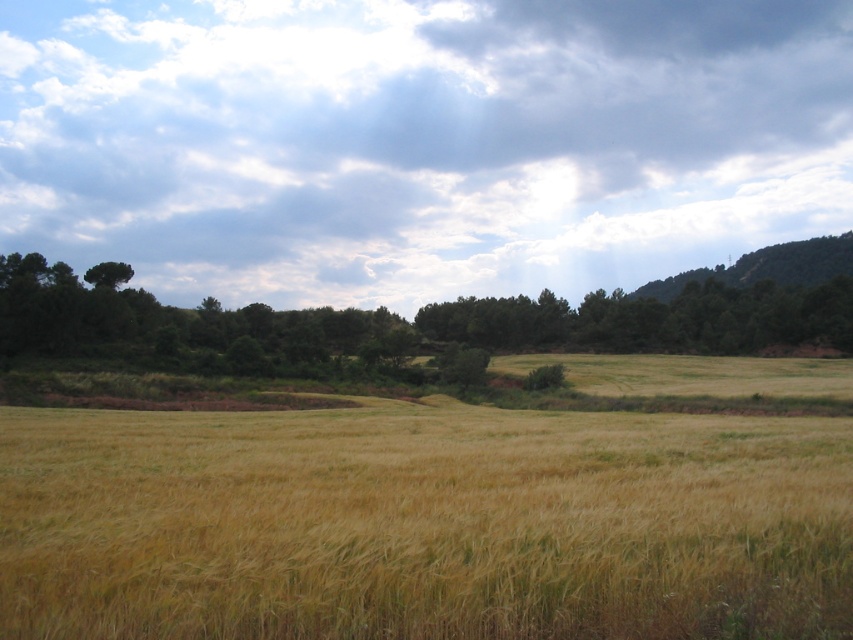
Question: Which point is closer to the camera?

Choices:
 (A) golden grassy field at center
 (B) green leafy tree at upper left
 (C) cloudy sky at upper center

Answer: (A)

Question: Which point is closer to the camera?

Choices:
 (A) (97, 282)
 (B) (399, 54)

Answer: (A)

Question: Does cloudy sky at upper center have a smaller size compared to green leafy tree at upper left?

Choices:
 (A) yes
 (B) no

Answer: (B)

Question: Which point is closer to the camera taking this photo?

Choices:
 (A) (102, 550)
 (B) (99, 285)

Answer: (A)

Question: Does cloudy sky at upper center appear over green leafy tree at upper left?

Choices:
 (A) no
 (B) yes

Answer: (B)

Question: Is cloudy sky at upper center to the right of green leafy tree at upper left from the viewer's perspective?

Choices:
 (A) yes
 (B) no

Answer: (A)